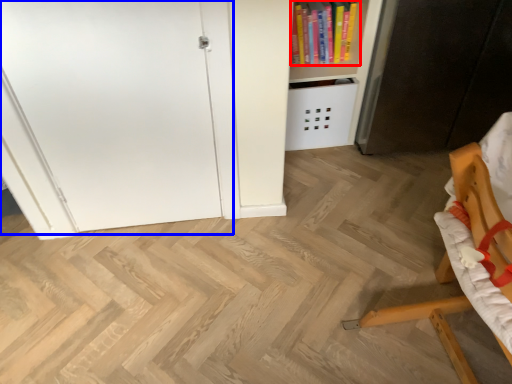
Question: Among these objects, which one is farthest to the camera, book (highlighted by a red box) or door (highlighted by a blue box)?

Choices:
 (A) book
 (B) door

Answer: (A)